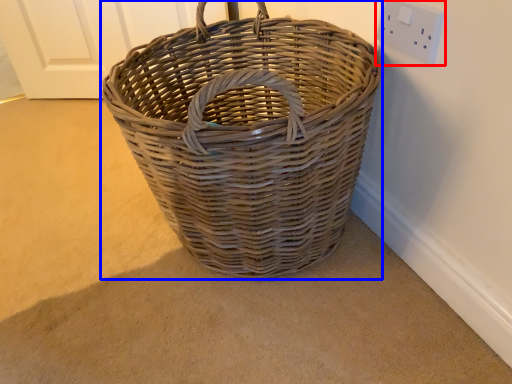
Question: Which object is further to the camera taking this photo, electric outlet (highlighted by a red box) or picnic basket (highlighted by a blue box)?

Choices:
 (A) electric outlet
 (B) picnic basket

Answer: (A)